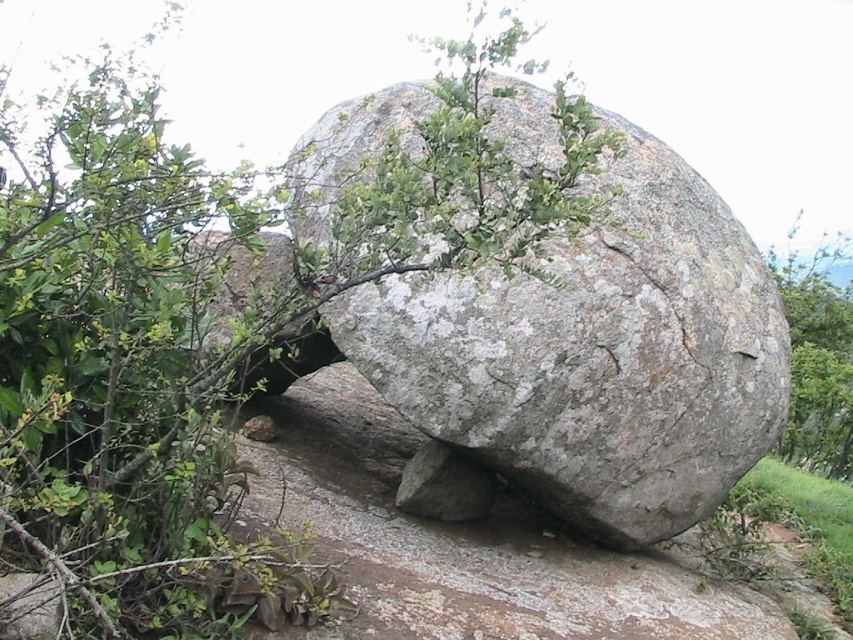
You are standing in front of a large boulder with two marked points on it. The points are labeled as point 1 at coordinates (x=639, y=193) and point 2 at coordinates (x=831, y=388). If you were to reach out and touch these points, which one would feel closer to your hand?

Point 1 at coordinates (x=639, y=193) is closer to the camera than point 2 at coordinates (x=831, y=388), so touching point 1 would feel closer to your hand.

You are standing in front of the large boulder and see the green leafy tree at center and the green leafy tree at right. Which tree is closer to your left side?

The green leafy tree at center is to the left of the green leafy tree at right, so the green leafy tree at center is closer to your left side.